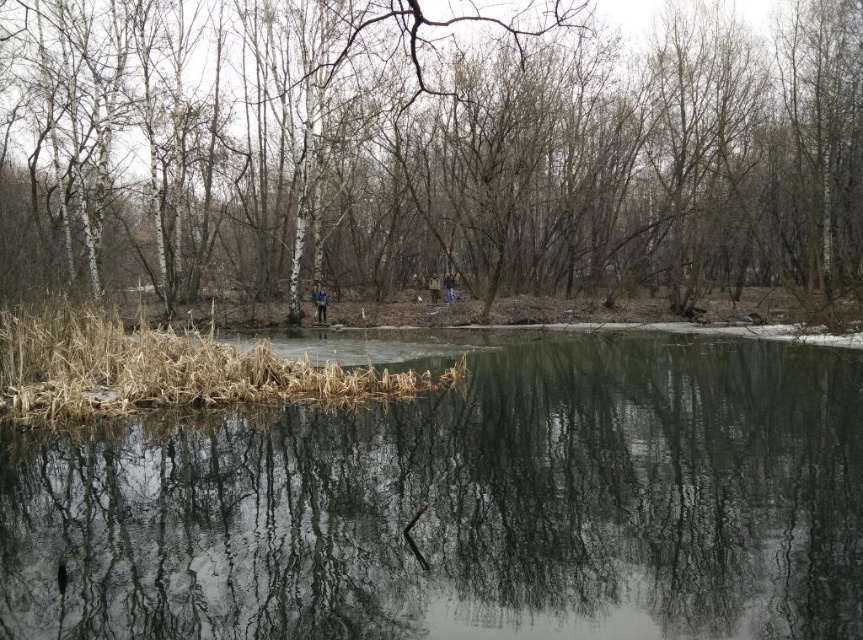
You are standing at the edge of the pond and see a brown bark tree at center and a dark blue jacket at center. Which object is positioned to the right side from your perspective?

The brown bark tree at center is positioned to the right of the dark blue jacket at center.

You are standing at the edge of the pond and want to reach the blue jeans at center without getting wet. The brown bark tree at center is in your path. Can you walk around the tree to reach the jeans?

The distance between the brown bark tree at center and blue jeans at center is 42.27 feet. Since the tree is in your path, you can walk around it to reach the jeans as long as there is enough space around the tree to maneuver.

You are standing at the edge of the pond and want to take a photo of the brown bark tree at center and the blue jeans at center. Which object will appear closer to you in the photo?

The brown bark tree at center will appear closer to you in the photo because it is in front of the blue jeans at center.